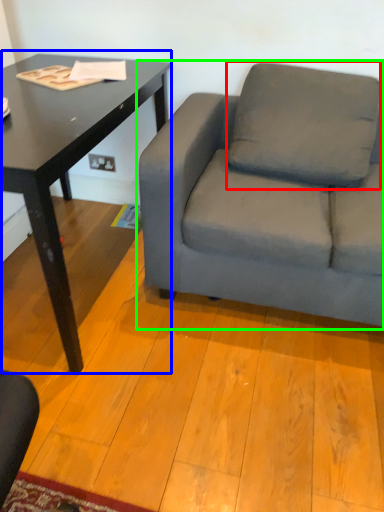
Question: Considering the real-world distances, which object is farthest from pillow (highlighted by a red box)? table (highlighted by a blue box) or studio couch (highlighted by a green box)?

Choices:
 (A) table
 (B) studio couch

Answer: (A)